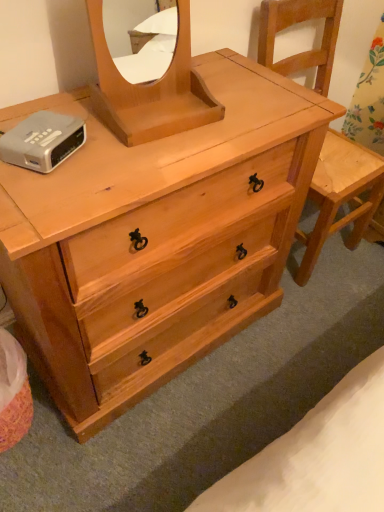
Identify the location of free space in front of natural wood chair at right. (312, 320).